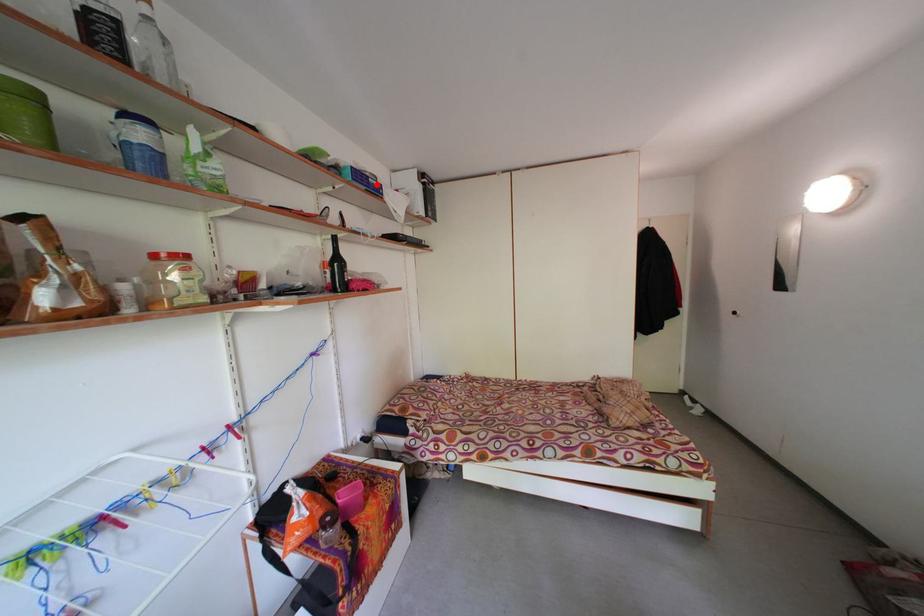
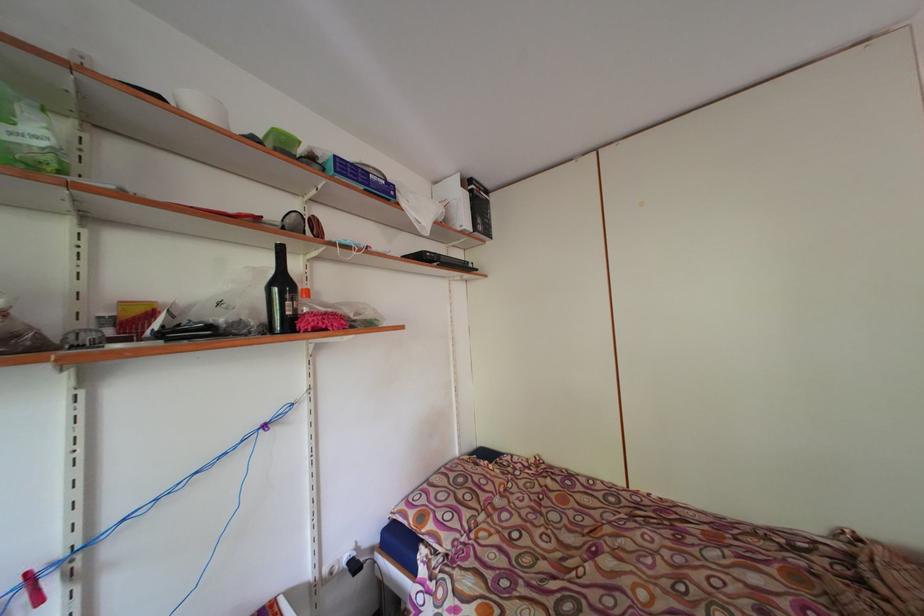
In the second image, find the point that corresponds to the highlighted location in the first image.

(377, 180)